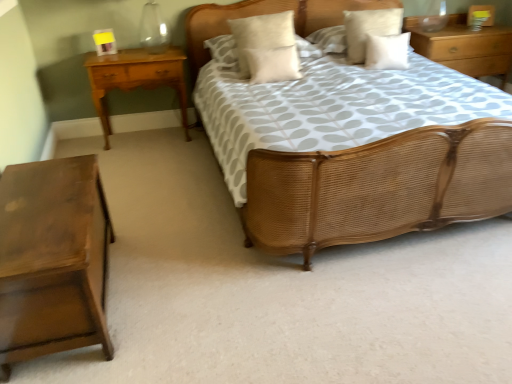
Image resolution: width=512 pixels, height=384 pixels. What are the coordinates of `free region under light brown wood nightstand at left, which appears as the 2th nightstand when ordered from the bottom (from a real-world perspective)` in the screenshot? It's located at (161, 134).